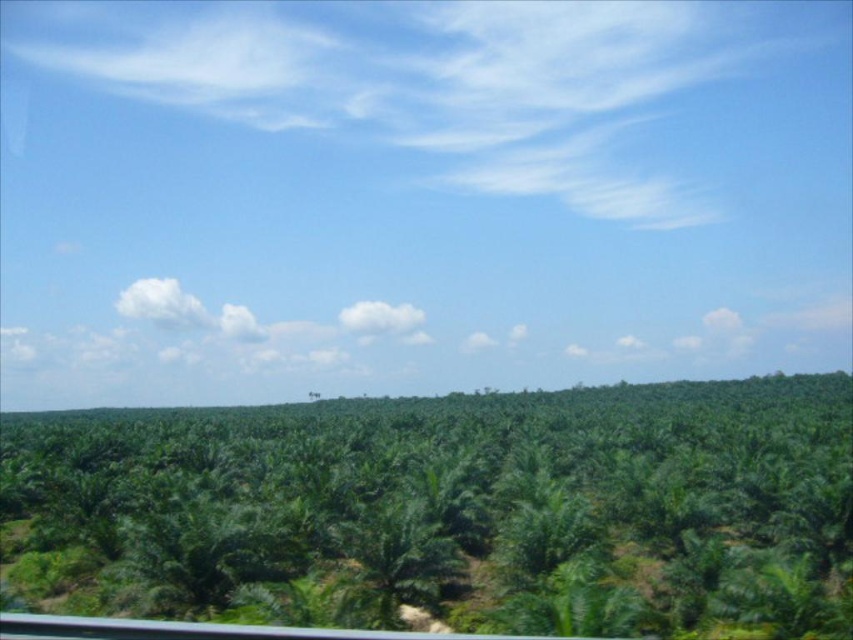
You are a drone operator trying to capture aerial footage of the tropical landscape. Your drone is currently hovering at the point marked by point (447, 509). Based on the scene description, what type of terrain or vegetation should you expect directly below your drone?

The point (447, 509) indicates green leafy jungle at center, so you should expect green leafy jungle directly below your drone.